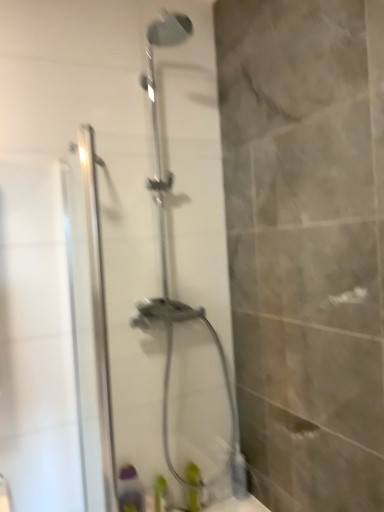
The height and width of the screenshot is (512, 384). Describe the element at coordinates (159, 492) in the screenshot. I see `green plastic bottle at lower center, acting as the second toiletry starting from the right` at that location.

The width and height of the screenshot is (384, 512). I want to click on green matte bottle at lower center, placed as the first toiletry when sorted from right to left, so click(x=192, y=486).

I want to click on clear glass shower door at center, so click(164, 290).

Is the surface of clear glass shower door at center in direct contact with green matte bottle at lower center, which is the 2th toiletry from left to right?

No, clear glass shower door at center is not beside green matte bottle at lower center, which is the 2th toiletry from left to right.

Who is bigger, clear glass shower door at center or green matte bottle at lower center, which is the 2th toiletry from left to right?

Bigger between the two is clear glass shower door at center.

From a real-world perspective, which object stands above the other?

From a 3D spatial view, clear glass shower door at center is above.

Identify the location of shower door that is above the green matte bottle at lower center, which is the 2th toiletry from left to right (from a real-world perspective). [164, 290].

From a real-world perspective, is green plastic bottle at lower center, acting as the second toiletry starting from the right, above or below green matte bottle at lower center, placed as the first toiletry when sorted from right to left?

From a real-world perspective, green plastic bottle at lower center, acting as the second toiletry starting from the right, is physically below green matte bottle at lower center, placed as the first toiletry when sorted from right to left.

Can you confirm if green plastic bottle at lower center, acting as the second toiletry starting from the right, is shorter than green matte bottle at lower center, placed as the first toiletry when sorted from right to left?

Yes, green plastic bottle at lower center, acting as the second toiletry starting from the right, is shorter than green matte bottle at lower center, placed as the first toiletry when sorted from right to left.

This screenshot has height=512, width=384. What are the coordinates of `toiletry located behind the green plastic bottle at lower center, placed as the first toiletry when sorted from left to right` in the screenshot? It's located at (192, 486).

Is clear glass shower door at center wider or thinner than green plastic bottle at lower center, acting as the second toiletry starting from the right?

clear glass shower door at center is thinner than green plastic bottle at lower center, acting as the second toiletry starting from the right.

Is clear glass shower door at center taller or shorter than green plastic bottle at lower center, placed as the first toiletry when sorted from left to right?

clear glass shower door at center is taller than green plastic bottle at lower center, placed as the first toiletry when sorted from left to right.

Who is bigger, clear glass shower door at center or green plastic bottle at lower center, placed as the first toiletry when sorted from left to right?

clear glass shower door at center is bigger.

Can you see green matte bottle at lower center, placed as the first toiletry when sorted from right to left, touching clear glass shower door at center?

No, green matte bottle at lower center, placed as the first toiletry when sorted from right to left, is not beside clear glass shower door at center.

Looking at this image, does green matte bottle at lower center, placed as the first toiletry when sorted from right to left, appear on the left side of clear glass shower door at center?

Yes.

In the scene shown: How distant is green matte bottle at lower center, which is the 2th toiletry from left to right, from clear glass shower door at center?

66.69 centimeters.

Is green matte bottle at lower center, which is the 2th toiletry from left to right, located outside clear glass shower door at center?

Indeed, green matte bottle at lower center, which is the 2th toiletry from left to right, is completely outside clear glass shower door at center.

From the image's perspective, between green plastic bottle at lower center, acting as the second toiletry starting from the right, and clear glass shower door at center, who is located below?

green plastic bottle at lower center, acting as the second toiletry starting from the right.

Is green plastic bottle at lower center, placed as the first toiletry when sorted from left to right, to the left of clear glass shower door at center from the viewer's perspective?

Indeed, green plastic bottle at lower center, placed as the first toiletry when sorted from left to right, is positioned on the left side of clear glass shower door at center.

This screenshot has height=512, width=384. I want to click on the 2nd toiletry located beneath the clear glass shower door at center (from a real-world perspective), so click(159, 492).

Looking at this image, who is smaller, green matte bottle at lower center, placed as the first toiletry when sorted from right to left, or green plastic bottle at lower center, acting as the second toiletry starting from the right?

Smaller between the two is green matte bottle at lower center, placed as the first toiletry when sorted from right to left.

How many degrees apart are the facing directions of green matte bottle at lower center, which is the 2th toiletry from left to right, and green plastic bottle at lower center, placed as the first toiletry when sorted from left to right?

The angle between the facing direction of green matte bottle at lower center, which is the 2th toiletry from left to right, and the facing direction of green plastic bottle at lower center, placed as the first toiletry when sorted from left to right, is 1.97 degrees.

Is green plastic bottle at lower center, acting as the second toiletry starting from the right, at the back of green matte bottle at lower center, which is the 2th toiletry from left to right?

green matte bottle at lower center, which is the 2th toiletry from left to right, is not turned away from green plastic bottle at lower center, acting as the second toiletry starting from the right.

From the clear glass shower door at center, count the 1st toiletry to the left and point to it. Please provide its 2D coordinates.

[(192, 486)]

You are a GUI agent. You are given a task and a screenshot of the screen. Output one action in this format:
    pyautogui.click(x=<x>, y=<y>)
    Task: Click on the toiletry above the green plastic bottle at lower center, placed as the first toiletry when sorted from left to right (from the image's perspective)
    
    Given the screenshot: What is the action you would take?
    pyautogui.click(x=192, y=486)

Based on the photo, estimate the real-world distances between objects in this image. Which object is closer to clear glass shower door at center, green matte bottle at lower center, which is the 2th toiletry from left to right, or green plastic bottle at lower center, placed as the first toiletry when sorted from left to right?

green matte bottle at lower center, which is the 2th toiletry from left to right, is closer to clear glass shower door at center.

From the picture: From the image, which object appears to be farther from green matte bottle at lower center, placed as the first toiletry when sorted from right to left, clear glass shower door at center or green plastic bottle at lower center, acting as the second toiletry starting from the right?

clear glass shower door at center.

From the image, which object appears to be farther from green plastic bottle at lower center, placed as the first toiletry when sorted from left to right, clear glass shower door at center or green matte bottle at lower center, which is the 2th toiletry from left to right?

clear glass shower door at center lies further to green plastic bottle at lower center, placed as the first toiletry when sorted from left to right, than the other object.

In the scene shown: Looking at the image, which one is located further to green matte bottle at lower center, which is the 2th toiletry from left to right, green plastic bottle at lower center, acting as the second toiletry starting from the right, or clear glass shower door at center?

clear glass shower door at center lies further to green matte bottle at lower center, which is the 2th toiletry from left to right, than the other object.

Which object lies nearer to the anchor point clear glass shower door at center, green plastic bottle at lower center, placed as the first toiletry when sorted from left to right, or green matte bottle at lower center, placed as the first toiletry when sorted from right to left?

green matte bottle at lower center, placed as the first toiletry when sorted from right to left.

Considering their positions, is green matte bottle at lower center, placed as the first toiletry when sorted from right to left, positioned closer to green plastic bottle at lower center, placed as the first toiletry when sorted from left to right, than clear glass shower door at center?

green matte bottle at lower center, placed as the first toiletry when sorted from right to left, lies closer to green plastic bottle at lower center, placed as the first toiletry when sorted from left to right, than the other object.

Find the location of a particular element. This screenshot has width=384, height=512. toiletry between clear glass shower door at center and green plastic bottle at lower center, acting as the second toiletry starting from the right, in the up-down direction is located at coordinates (192, 486).